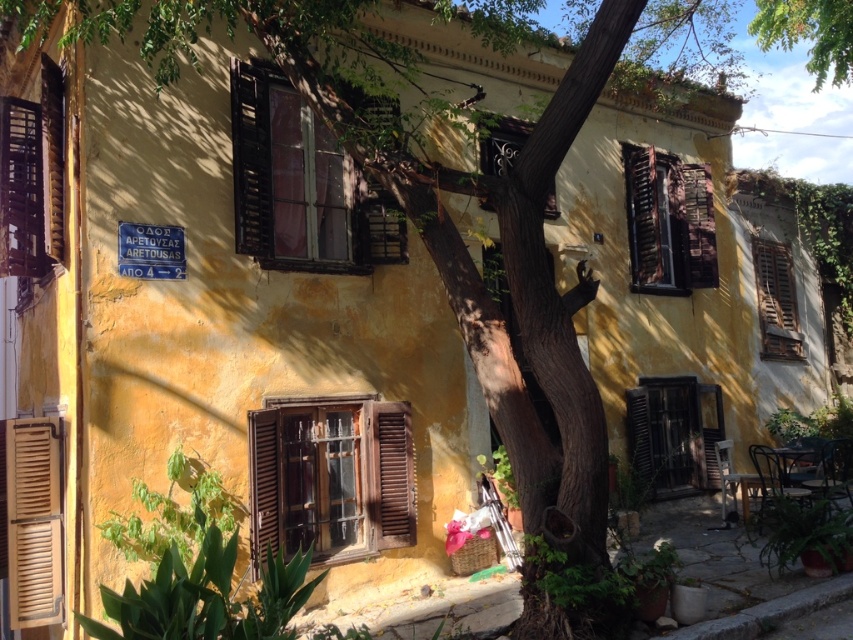
Question: Is wooden shutters at center to the right of wooden shutters at right from the viewer's perspective?

Choices:
 (A) no
 (B) yes

Answer: (A)

Question: Which point is farther to the camera?

Choices:
 (A) (402, 433)
 (B) (39, 467)
 (C) (265, 100)
 (D) (675, 268)

Answer: (D)

Question: Among these points, which one is farthest from the camera?

Choices:
 (A) (682, 225)
 (B) (772, 282)

Answer: (B)

Question: Among these points, which one is nearest to the camera?

Choices:
 (A) (793, 348)
 (B) (309, 220)
 (C) (38, 621)
 (D) (715, 276)

Answer: (C)

Question: Is brown wooden shutters at center closer to the viewer compared to wooden shutters at upper right?

Choices:
 (A) yes
 (B) no

Answer: (A)

Question: Considering the relative positions of wooden shutters at center and wooden shutters at upper right in the image provided, where is wooden shutters at center located with respect to wooden shutters at upper right?

Choices:
 (A) right
 (B) left

Answer: (B)